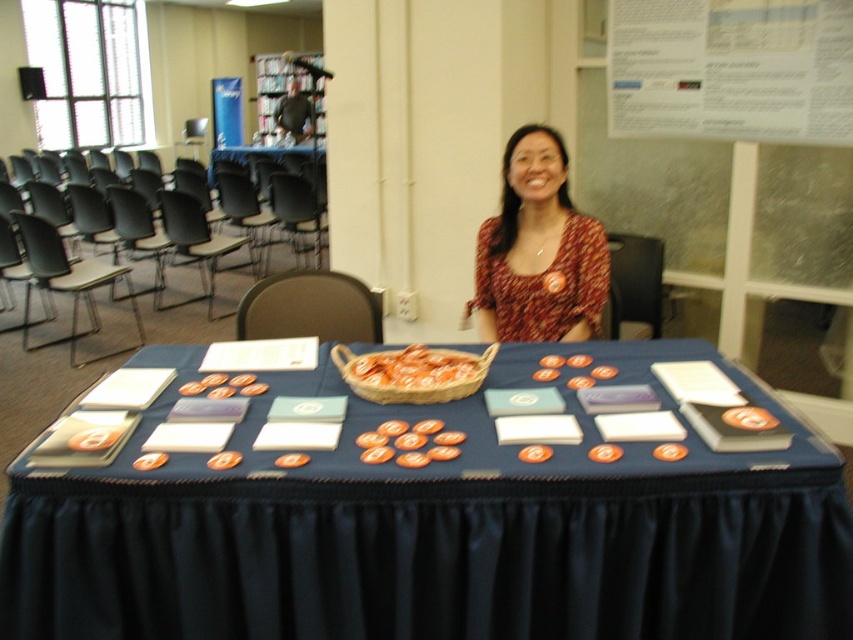
Which is in front, point (167, 513) or point (564, 236)?

Point (167, 513) is in front.

Who is more forward, (189, 352) or (549, 192)?

Point (189, 352) is in front.

You are a GUI agent. You are given a task and a screenshot of the screen. Output one action in this format:
    pyautogui.click(x=<x>, y=<y>)
    Task: Click on the blue fabric table at center
    
    Given the screenshot: What is the action you would take?
    434,529

Is printed fabric blouse at center further to the viewer compared to orange matte basket at center?

Yes, printed fabric blouse at center is further from the viewer.

Looking at this image, measure the distance between printed fabric blouse at center and orange matte basket at center.

They are 21.59 inches apart.

Is point (584, 282) farther from camera compared to point (399, 380)?

Yes, it is.

Where is `printed fabric blouse at center`? printed fabric blouse at center is located at coordinates (538, 250).

Is point (674, 481) closer to camera compared to point (451, 360)?

Yes, it is.

What do you see at coordinates (434, 529) in the screenshot? This screenshot has height=640, width=853. I see `blue fabric table at center` at bounding box center [434, 529].

Between point (798, 560) and point (401, 374), which one is positioned in front?

Positioned in front is point (798, 560).

At what (x,y) coordinates should I click in order to perform the action: click on blue fabric table at center. Please return your answer as a coordinate pair (x, y). The width and height of the screenshot is (853, 640). Looking at the image, I should click on (434, 529).